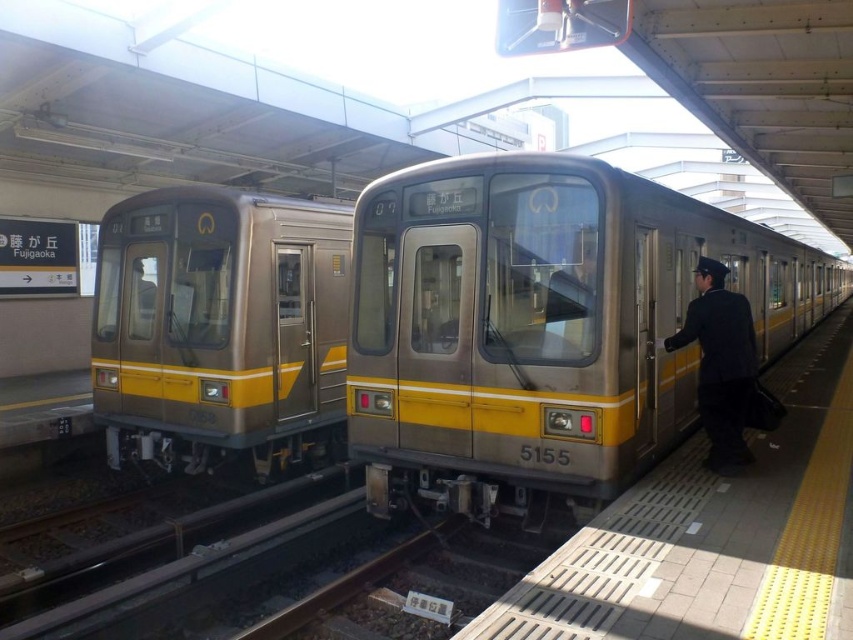
In the scene shown: You are a passenger waiting at the train station platform. You see the metallic silver train at left and the dark blue uniform at right. Which object is positioned to the left of the other?

The metallic silver train at left is positioned to the left of the dark blue uniform at right.

You are standing at the entrance of the train station platform. You need to board the metallic silver train at center. Which direction should you walk to reach it?

The metallic silver train at center is located at point (543, 324), so you should walk towards the center of the platform to reach it.